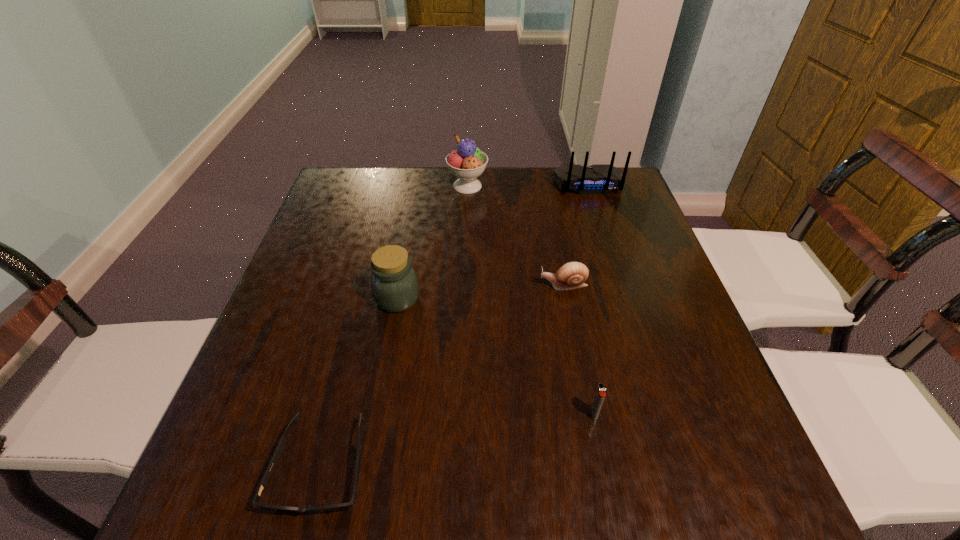
Where is `unoccupied area between the jar and the fourth object from right to left`? This screenshot has height=540, width=960. unoccupied area between the jar and the fourth object from right to left is located at coordinates [433, 242].

Identify the location of vacant area that lies between the nearest object and the icecream. (395, 327).

The image size is (960, 540). I want to click on unoccupied position between the third shortest object and the jar, so click(x=495, y=356).

Where is `free space between the fourth tallest object and the router`? free space between the fourth tallest object and the router is located at coordinates [591, 299].

You are a GUI agent. You are given a task and a screenshot of the screen. Output one action in this format:
    pyautogui.click(x=<x>, y=<y>)
    Task: Click on the free spot between the icecream and the sunglasses
    
    Given the screenshot: What is the action you would take?
    pyautogui.click(x=395, y=327)

The height and width of the screenshot is (540, 960). Identify the location of empty space between the nearest object and the escargot. (443, 376).

Identify the location of empty space between the third shortest object and the escargot. (579, 349).

Find the location of a particular element. This screenshot has height=540, width=960. the closest object to the igniter is located at coordinates (572, 275).

Locate which object ranks third in proximity to the escargot. Please provide its 2D coordinates. Your answer should be formatted as a tuple, i.e. [(x, y)], where the tuple contains the x and y coordinates of a point satisfying the conditions above.

[(597, 179)]

Find the location of `free point that satisfies the following two spatial constraints: 1. on the front side of the fifth farthest object; 2. on the right side of the jar`. free point that satisfies the following two spatial constraints: 1. on the front side of the fifth farthest object; 2. on the right side of the jar is located at coordinates (376, 414).